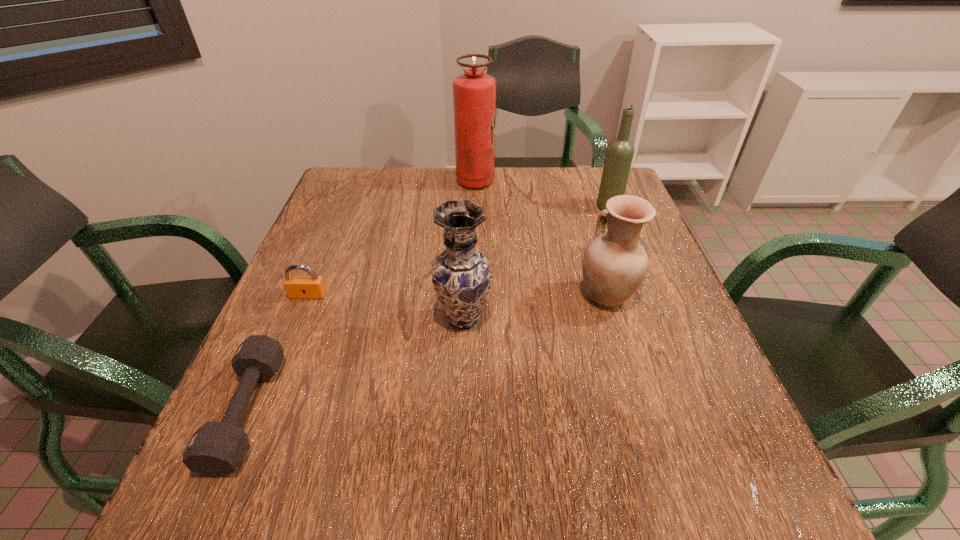
This screenshot has height=540, width=960. What are the coordinates of `pottery located at the right edge` in the screenshot? It's located at pos(614,264).

The image size is (960, 540). Identify the location of object that is at the near left corner. (216, 449).

At what (x,y) coordinates should I click in order to perform the action: click on object at the far right corner. Please return your answer as a coordinate pair (x, y). The image size is (960, 540). Looking at the image, I should click on coord(619,154).

Find the location of a particular element. vacant space at the far edge of the desktop is located at coordinates (517, 200).

You are a GUI agent. You are given a task and a screenshot of the screen. Output one action in this format:
    pyautogui.click(x=<x>, y=<y>)
    Task: Click on the vacant space at the near edge of the desktop
    The image size is (960, 540).
    Given the screenshot: What is the action you would take?
    pyautogui.click(x=322, y=488)

In the image, there is a desktop. Identify the location of vacant space at the left edge. Image resolution: width=960 pixels, height=540 pixels. (319, 310).

Where is `free point at the right edge`? free point at the right edge is located at coordinates 649,427.

In the image, there is a desktop. Identify the location of free space at the far right corner. (577, 180).

At what (x,y) coordinates should I click in order to perform the action: click on vacant space in between the fifth nearest object and the vase. Please return your answer as a coordinate pair (x, y). Looking at the image, I should click on (536, 263).

This screenshot has width=960, height=540. I want to click on unoccupied position between the fifth tallest object and the farthest object, so click(x=392, y=238).